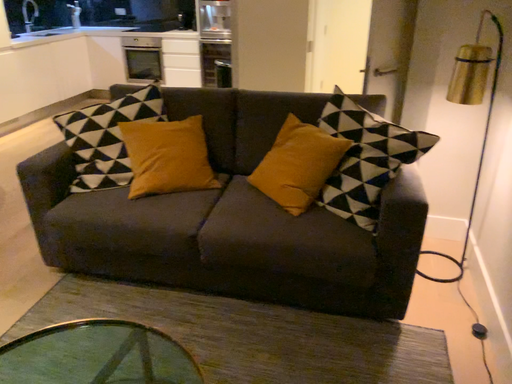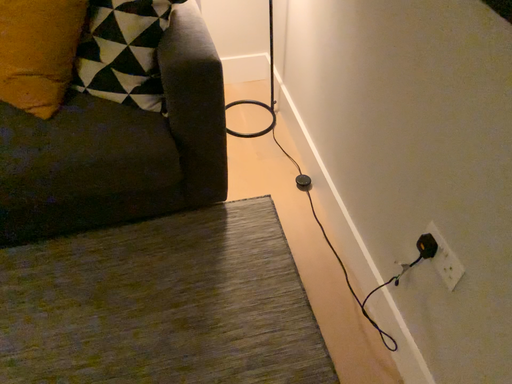
Question: Which way did the camera rotate in the video?

Choices:
 (A) rotated downward
 (B) rotated upward

Answer: (A)